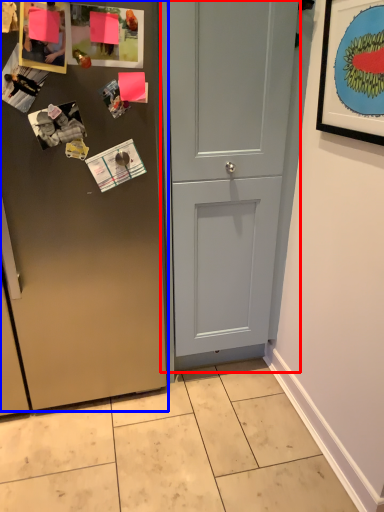
Question: Which object is closer to the camera taking this photo, door (highlighted by a red box) or door (highlighted by a blue box)?

Choices:
 (A) door
 (B) door

Answer: (B)